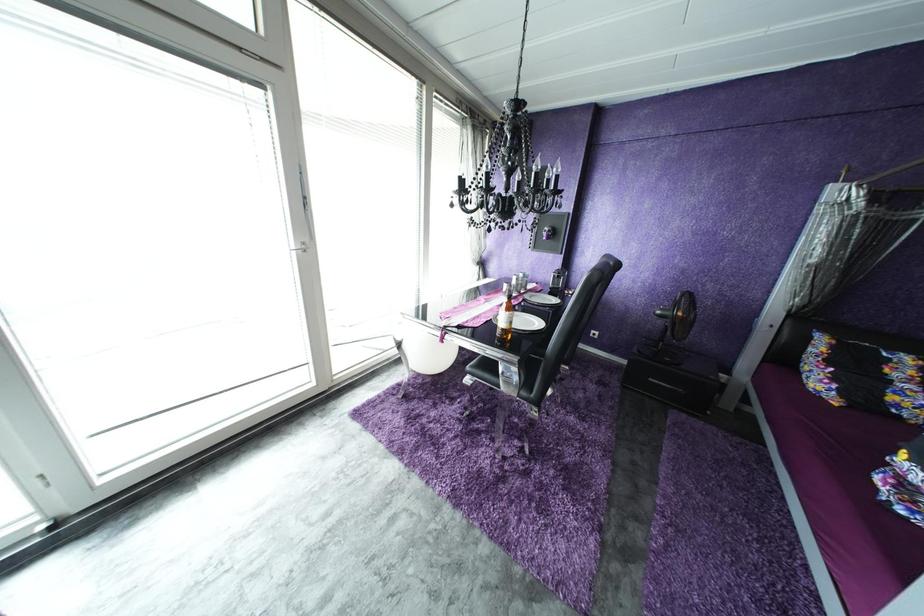
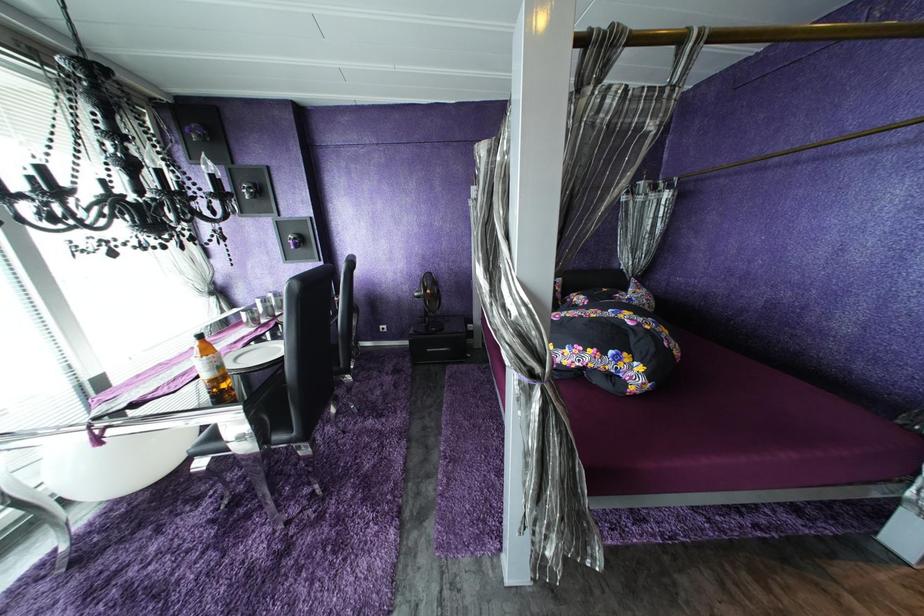
Question: The first image is from the beginning of the video and the second image is from the end. How did the camera likely rotate when shooting the video?

Choices:
 (A) Left
 (B) Right
 (C) Up
 (D) Down

Answer: (B)